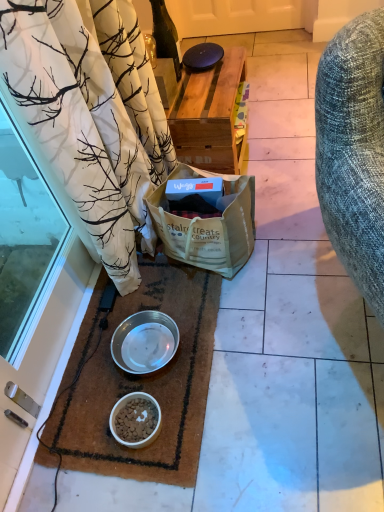
You are a GUI agent. You are given a task and a screenshot of the screen. Output one action in this format:
    pyautogui.click(x=<x>, y=<y>)
    Task: Click on the free space on the front side of white cardboard box at center
    
    Given the screenshot: What is the action you would take?
    pos(235,317)